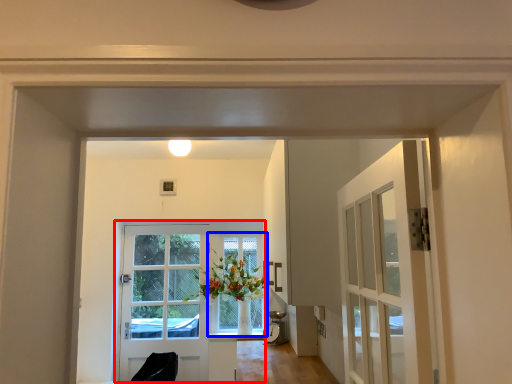
Question: Which point is further to the camera, door (highlighted by a red box) or window (highlighted by a blue box)?

Choices:
 (A) door
 (B) window

Answer: (B)